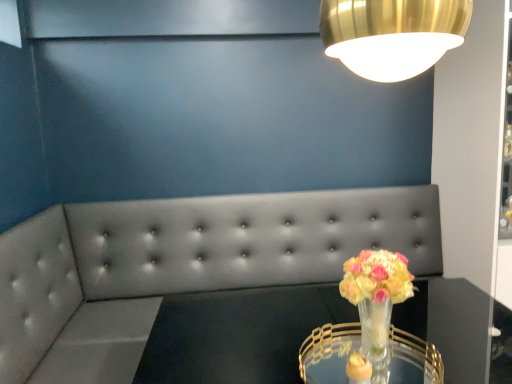
Question: From the image's perspective, is translucent glass vase at center positioned above or below clear glass table at center?

Choices:
 (A) above
 (B) below

Answer: (A)

Question: Looking at their shapes, would you say translucent glass vase at center is wider or thinner than clear glass table at center?

Choices:
 (A) thin
 (B) wide

Answer: (A)

Question: Which object is the farthest from the tufted leather couch at center?

Choices:
 (A) translucent glass vase at center
 (B) clear glass table at center
 (C) clear glass table at center

Answer: (A)

Question: Considering the real-world distances, which object is farthest from the translucent glass vase at center?

Choices:
 (A) tufted leather couch at center
 (B) clear glass table at center
 (C) clear glass table at center

Answer: (A)